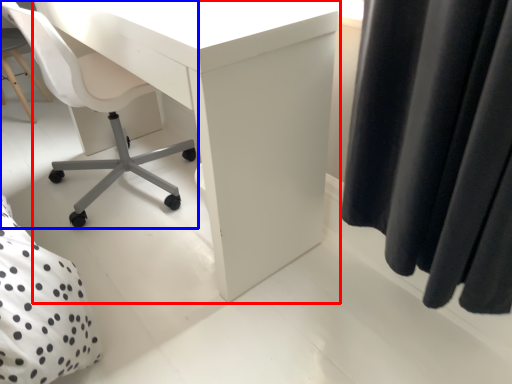
Question: Which point is closer to the camera, desk (highlighted by a red box) or chair (highlighted by a blue box)?

Choices:
 (A) desk
 (B) chair

Answer: (A)